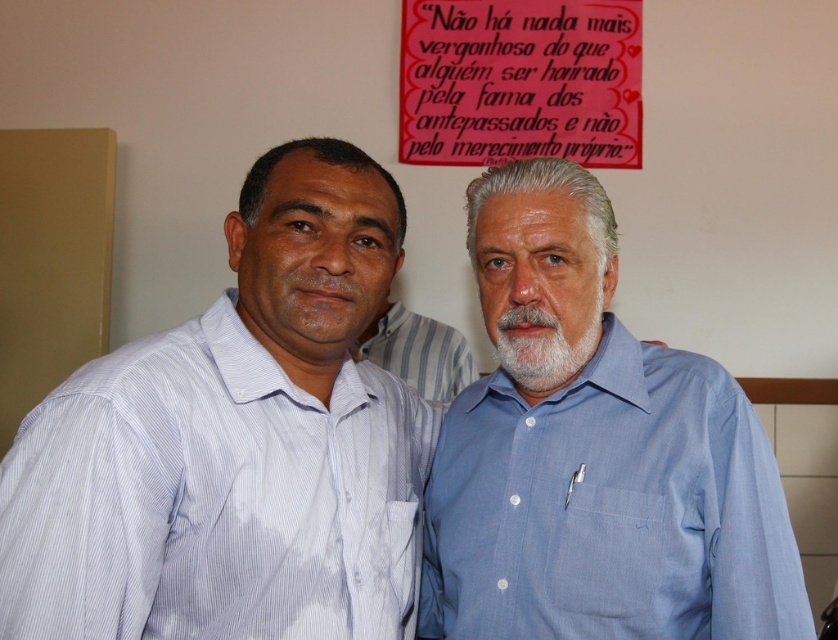
You are trying to decide which shirt to wear for a casual event. You have the white striped shirt at left and the striped cotton shirt at center. Based on the image, which shirt is wider?

The white striped shirt at left is wider than the striped cotton shirt at center because its width surpasses the other shirt.

You are a photographer trying to capture both the white striped shirt at left and the white soft beard at center in a single frame. Considering their sizes, which object should you focus on to ensure both are clearly visible?

The white striped shirt at left is larger in size compared to the white soft beard at center, so focusing on the white striped shirt at left would help ensure both are clearly visible in the frame.

You are a photographer setting up for a group photo. You see a white striped shirt at left and a striped cotton shirt at center. Which shirt should you adjust to ensure both are centered in the frame?

The white striped shirt at left is to the left of the striped cotton shirt at center. To center both in the frame, move the white striped shirt at left to the right until it aligns with the striped cotton shirt at center.